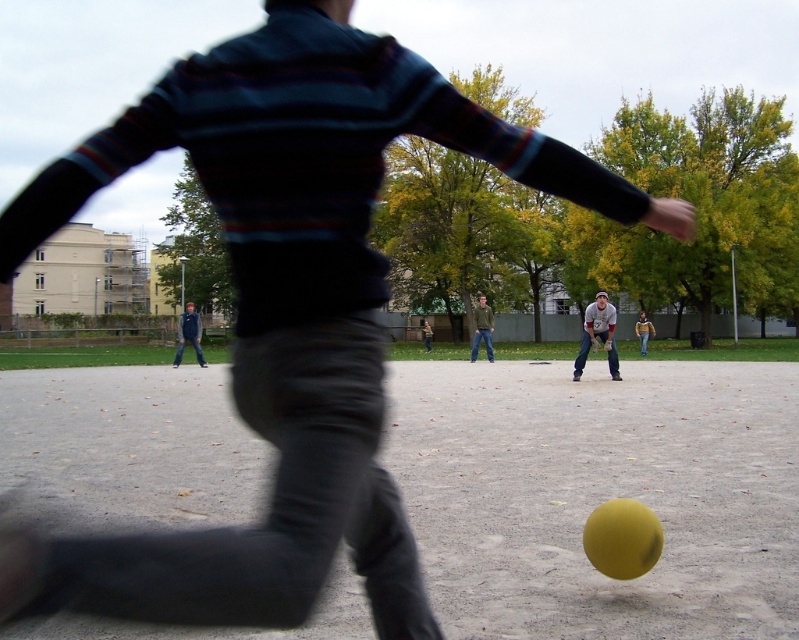
Question: Considering the relative positions of dark blue jeans at center and denim jacket at center in the image provided, where is dark blue jeans at center located with respect to denim jacket at center?

Choices:
 (A) above
 (B) below

Answer: (A)

Question: Can you confirm if dark blue jeans at center is smaller than denim jacket at center?

Choices:
 (A) no
 (B) yes

Answer: (A)

Question: Based on their relative distances, which object is farther from the gray cotton shirt at center?

Choices:
 (A) dark blue jeans at center
 (B) denim jacket at center

Answer: (A)

Question: Is dark blue jeans at center bigger than denim jacket at center?

Choices:
 (A) yes
 (B) no

Answer: (A)

Question: Which of the following is the closest to the observer?

Choices:
 (A) gray cotton shirt at center
 (B) dark blue jeans at center

Answer: (A)

Question: Among these points, which one is farthest from the camera?

Choices:
 (A) (197, 330)
 (B) (491, 326)
 (C) (611, 360)

Answer: (A)